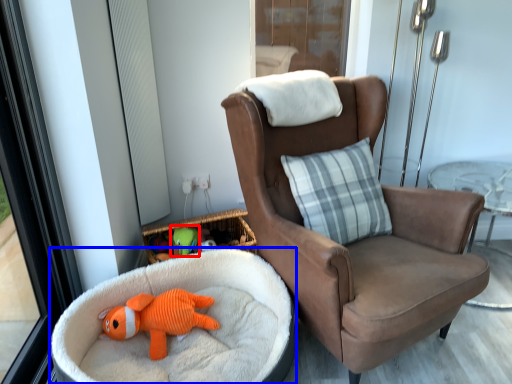
Question: Which point is further to the camera, toy (highlighted by a red box) or dog bed (highlighted by a blue box)?

Choices:
 (A) toy
 (B) dog bed

Answer: (A)